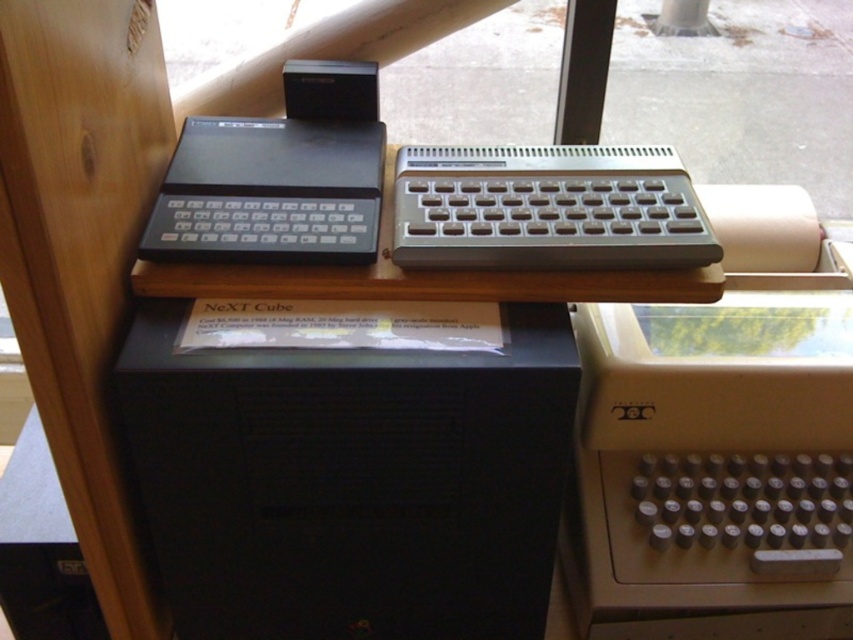
Can you confirm if metallic silver keyboard at center is thinner than black plastic keyboard at left?

Incorrect, metallic silver keyboard at center's width is not less than black plastic keyboard at left's.

How distant is metallic silver keyboard at center from black plastic keyboard at left?

metallic silver keyboard at center is 4.76 inches away from black plastic keyboard at left.

What do you see at coordinates (547, 209) in the screenshot? I see `metallic silver keyboard at center` at bounding box center [547, 209].

Locate an element on the screen. metallic silver keyboard at center is located at coordinates (547, 209).

Locate an element on the screen. black plastic next cube at center is located at coordinates (350, 481).

Which of these two, black plastic next cube at center or metallic silver keyboard at center, stands shorter?

metallic silver keyboard at center is shorter.

In order to click on black plastic next cube at center in this screenshot , I will do `click(350, 481)`.

Can you confirm if black plastic next cube at center is taller than black plastic keyboard at left?

Yes.

How much distance is there between black plastic next cube at center and black plastic keyboard at left?

black plastic next cube at center and black plastic keyboard at left are 7.17 inches apart.

The width and height of the screenshot is (853, 640). Find the location of `black plastic next cube at center`. black plastic next cube at center is located at coordinates (350, 481).